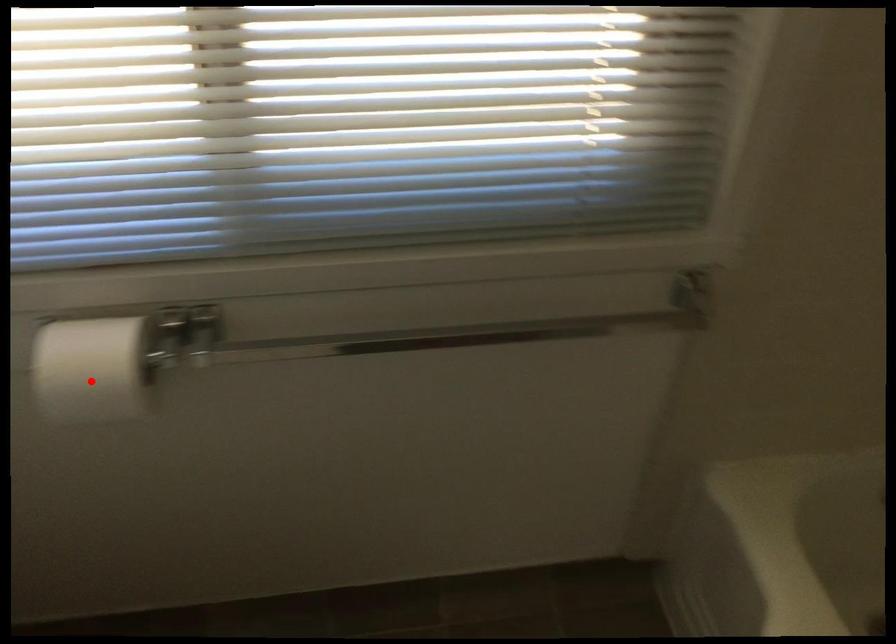
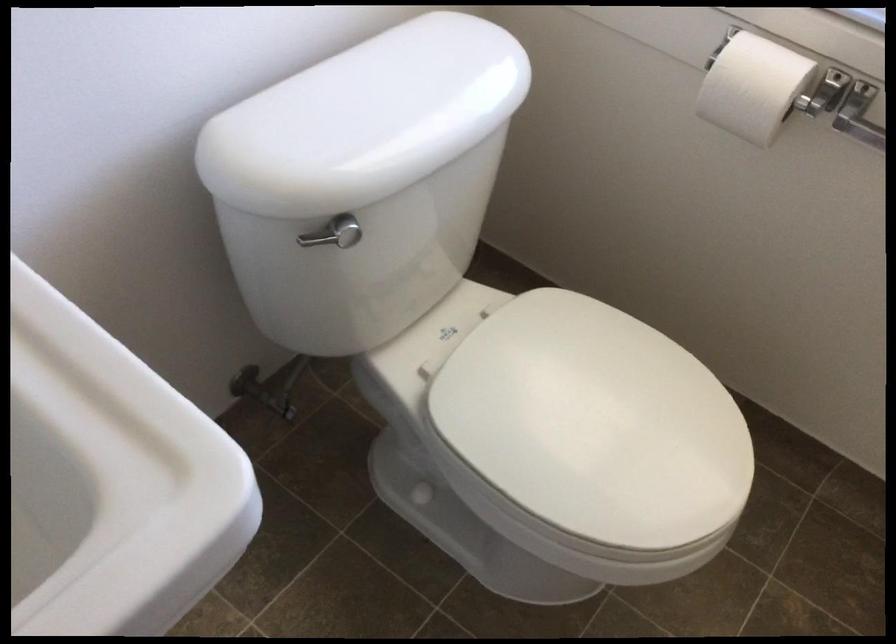
In the second image, find the point that corresponds to the highlighted location in the first image.

(753, 87)